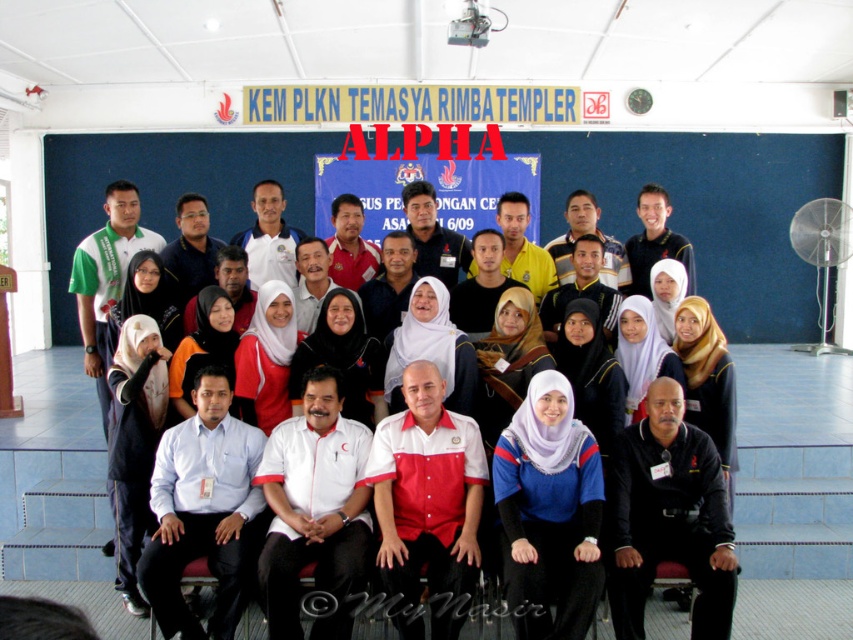
You are standing in the middle of the room and want to move to the point that is closer to the stage. Which point should you head towards, point (691, 512) or point (532, 484)?

Point (532, 484) is closer to the stage because it is closer to the viewer compared to point (691, 512), which is further away.

You are organizing a photo shoot and need to arrange two models wearing the black matte shirt at lower right and the blue jersey at center. According to the image, which model should stand to the left to maintain the original spatial relationship?

The blue jersey at center should stand to the left because the black matte shirt at lower right is positioned on the right side of the blue jersey at center in the original image.

You are organizing a clothing display and need to arrange the light blue shirt at center and the white matte shirt at center side by side on a mannequin. Which shirt should be placed on the left if you want the narrower one to be on the left?

The light blue shirt at center should be placed on the left since it is narrower than the white matte shirt at center.